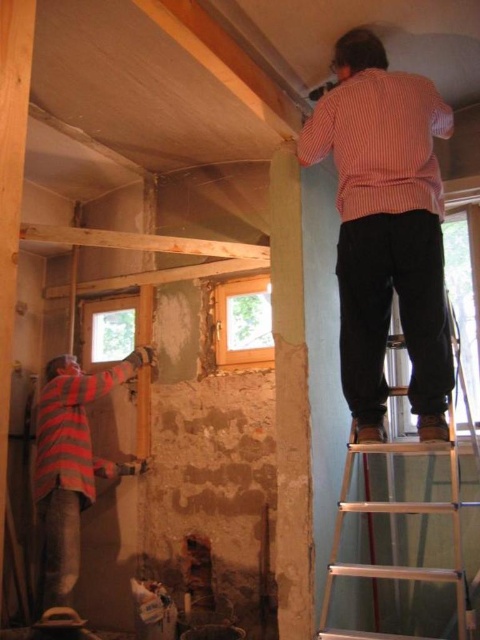
Based on the scene described, which object is taller between the striped cotton shirt at upper right and the striped fabric construction worker at lower left?

The striped cotton shirt at upper right is much taller than the striped fabric construction worker at lower left.

You are a safety inspector evaluating this construction site. You notice the striped fabric construction worker at lower left and the silver metallic ladder at upper right. Based on their sizes, which object might pose a safety hazard and why?

The striped fabric construction worker at lower left has a smaller size compared to the silver metallic ladder at upper right. This smaller worker might not be able to safely handle heavy equipment or maintain balance on the ladder, posing a potential safety hazard.